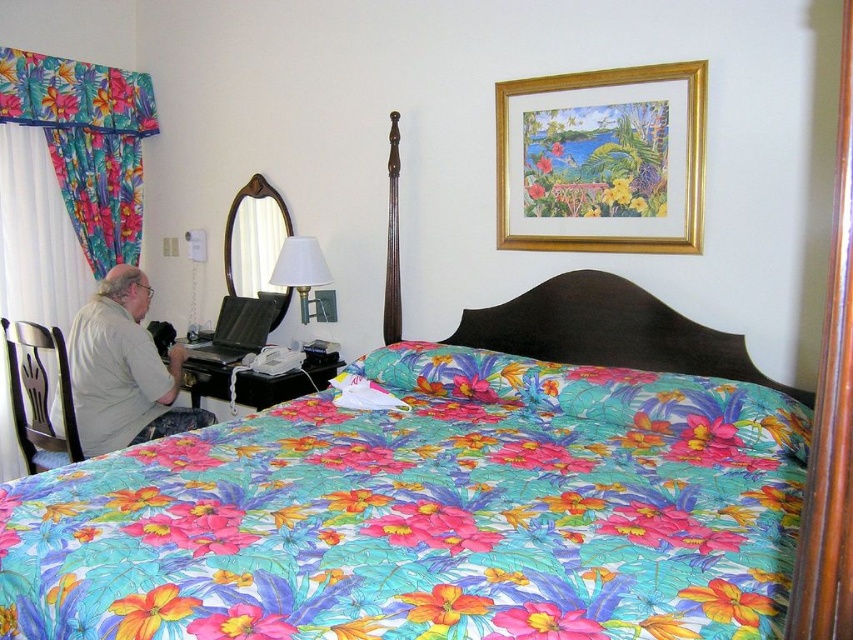
You are organizing a closet in the bedroom and need to decide where to place the floral fabric curtain at left and the gray cotton shirt at left. Since space is limited, which item should you place first to ensure both fit?

The floral fabric curtain at left is larger in size than the gray cotton shirt at left, so you should place the floral fabric curtain at left first to ensure both items fit in the limited space.